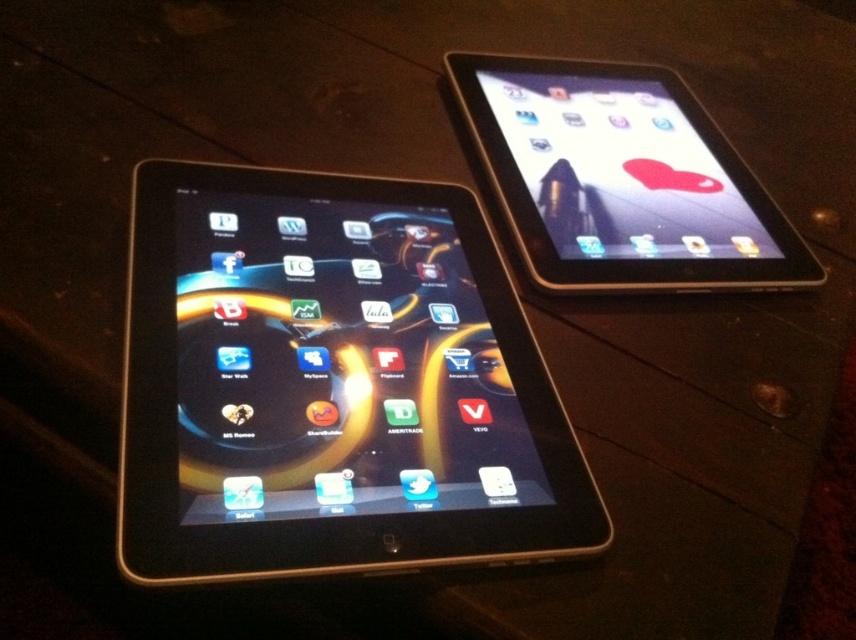
You are standing 30 inches away from the dark wooden surface where the iPads are placed. Can you reach the point at coordinates point [465,452] without moving closer?

The point at coordinates point [465,452] is 31.79 inches away from the viewer. Since you are standing 30 inches away, you cannot reach it without moving closer.

You are organizing a tech fair and need to arrange these two tablets so that the black glossy tablet at left is above the satin black tablet at upper right. Can you do this based on their current positions?

The black glossy tablet at left is currently below the satin black tablet at upper right, so to place it above, you would need to move it upwards relative to the satin black tablet at upper right.

You are standing in front of the two iPads on the dark wooden surface. Which of the two points, point (163,531) or point (560,61), is closer to you?

Point (163,531) is in front of point (560,61), so it is closer to you.